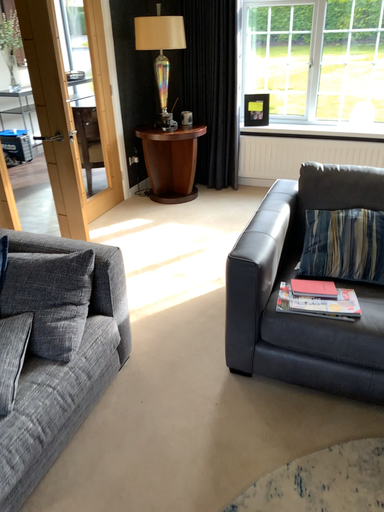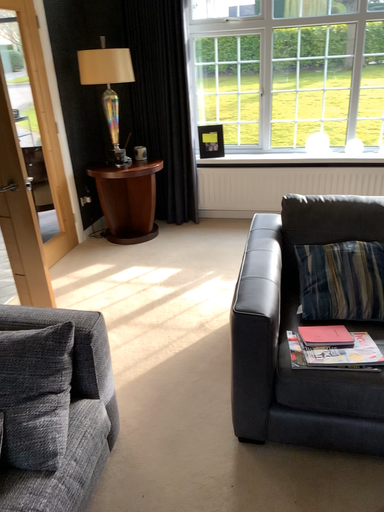
Question: How did the camera likely rotate when shooting the video?

Choices:
 (A) rotated right
 (B) rotated left

Answer: (A)